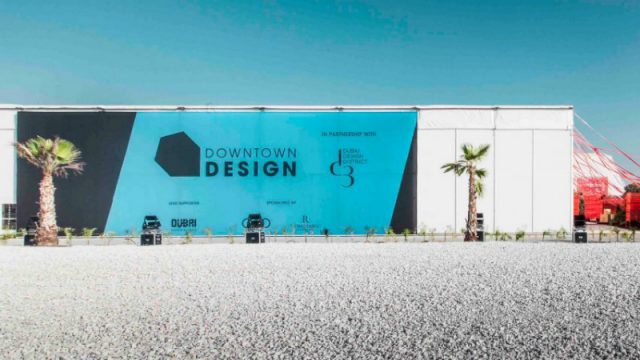
Identify the location of window. (11, 219).